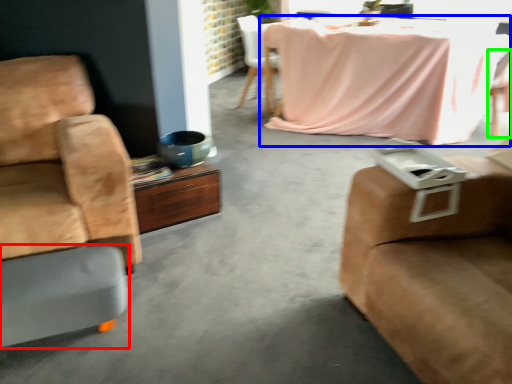
Question: Estimate the real-world distances between objects in this image. Which object is farther from footrest (highlighted by a red box), kitchen & dining room table (highlighted by a blue box) or chair (highlighted by a green box)?

Choices:
 (A) kitchen & dining room table
 (B) chair

Answer: (B)